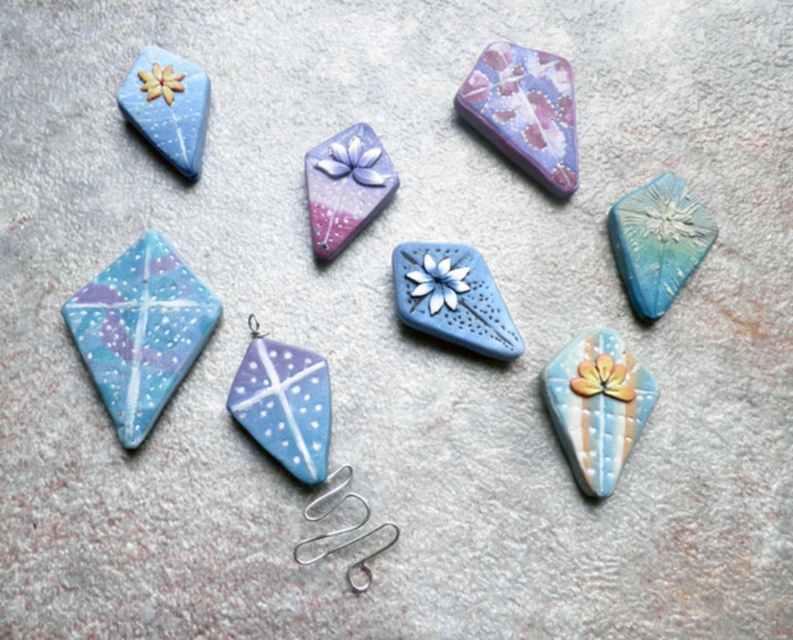
The height and width of the screenshot is (640, 793). What do you see at coordinates (345, 186) in the screenshot? I see `purple glossy flower at center` at bounding box center [345, 186].

What do you see at coordinates (345, 186) in the screenshot? This screenshot has height=640, width=793. I see `purple glossy flower at center` at bounding box center [345, 186].

Find the location of a particular element. purple glossy flower at center is located at coordinates (345, 186).

Between pastel glossy square at upper center and matte pastel diamond at lower right, which one has more height?

With more height is pastel glossy square at upper center.

Between pastel glossy square at upper center and matte pastel diamond at lower right, which one appears on the right side from the viewer's perspective?

Positioned to the right is matte pastel diamond at lower right.

Who is more distant from viewer, (481, 77) or (619, 451)?

The point (481, 77) is more distant.

Identify the location of pastel glossy square at upper center. (523, 112).

Which is above, matte blue stone at upper right or purple glossy flower at center?

purple glossy flower at center

This screenshot has width=793, height=640. Identify the location of matte blue stone at upper right. (657, 241).

This screenshot has width=793, height=640. Identify the location of matte blue stone at upper right. (657, 241).